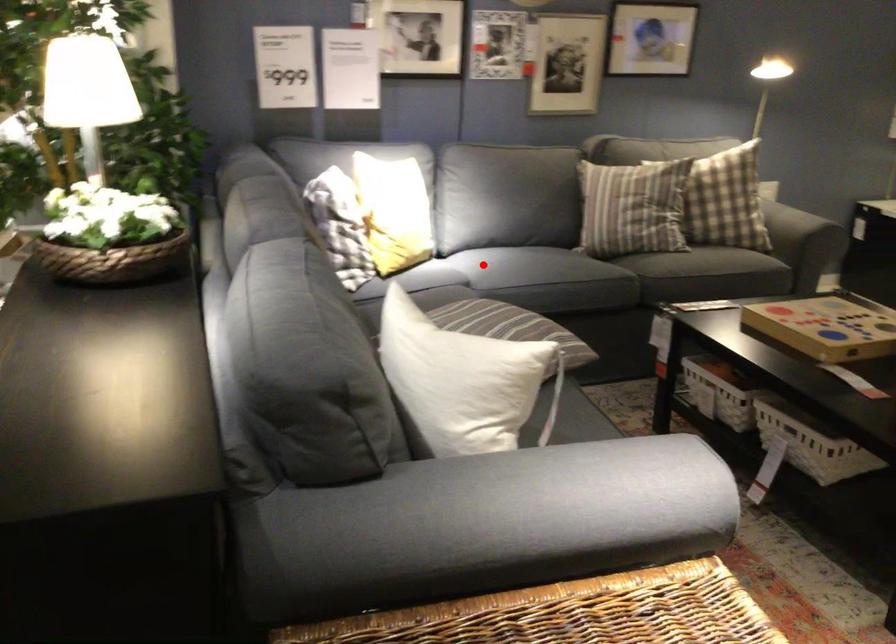
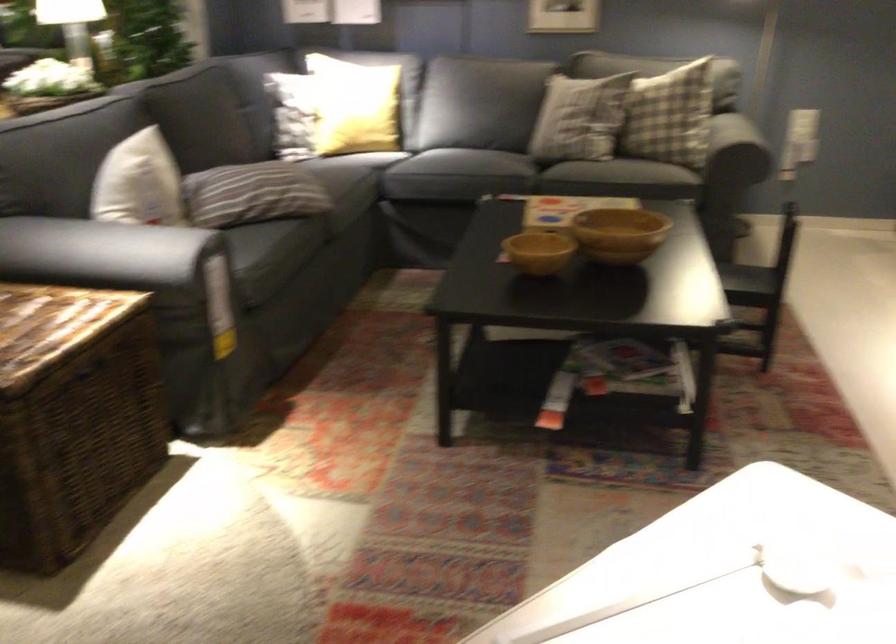
Question: I am providing you with two images of the same scene from different viewpoints. Image1 has a red point marked. In image2, the corresponding 3D location appears at what relative position? Reply with the corresponding letter.

Choices:
 (A) Closer
 (B) Farther

Answer: (B)